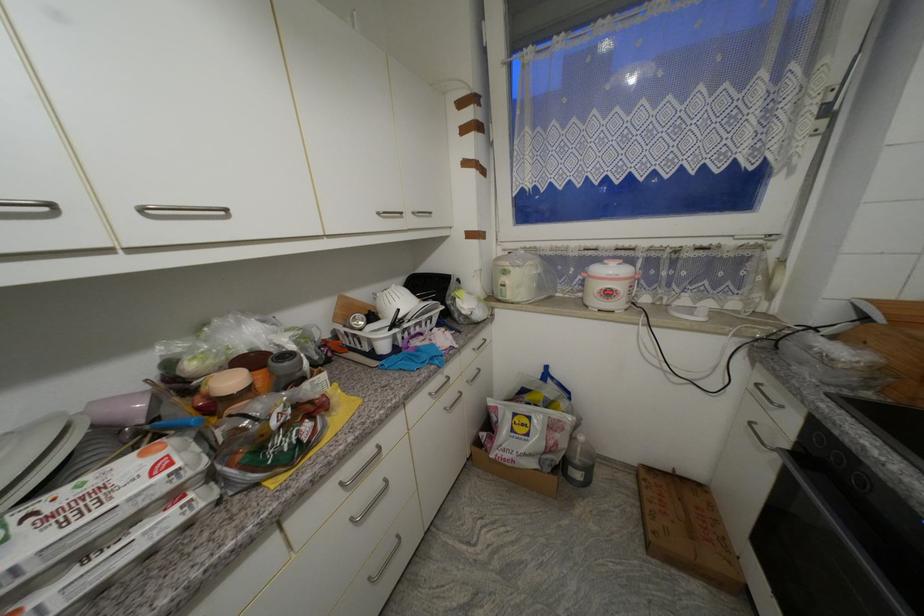
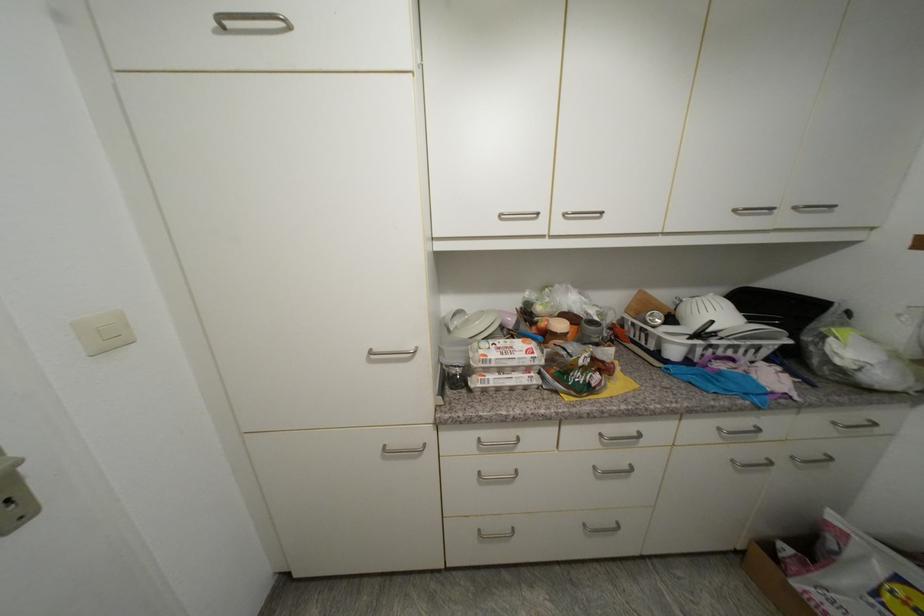
Locate, in the second image, the point that corresponds to (x=347, y=299) in the first image.

(647, 294)